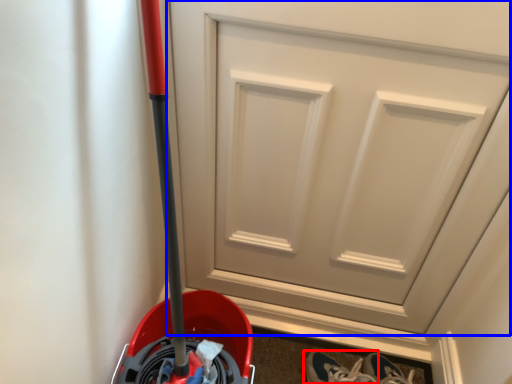
Question: Which object appears farthest to the camera in this image, footwear (highlighted by a red box) or door (highlighted by a blue box)?

Choices:
 (A) footwear
 (B) door

Answer: (A)